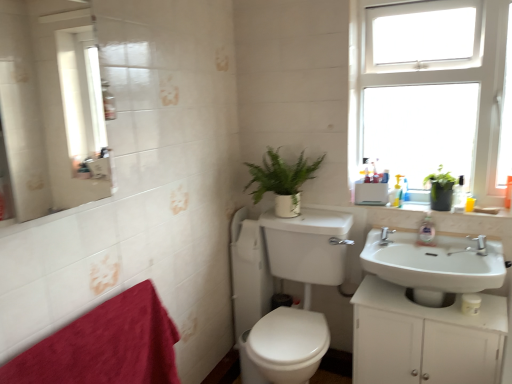
Question: Is white matte cabinet at lower right wider than green matte plant at upper right?

Choices:
 (A) yes
 (B) no

Answer: (A)

Question: Is white matte cabinet at lower right placed right next to green matte plant at upper right?

Choices:
 (A) yes
 (B) no

Answer: (B)

Question: Is white matte cabinet at lower right positioned far away from green matte plant at upper right?

Choices:
 (A) yes
 (B) no

Answer: (B)

Question: Is white matte cabinet at lower right positioned behind green matte plant at upper right?

Choices:
 (A) no
 (B) yes

Answer: (A)

Question: From the image's perspective, is white matte cabinet at lower right over green matte plant at upper right?

Choices:
 (A) no
 (B) yes

Answer: (A)

Question: From a real-world perspective, is white matte cabinet at lower right physically located above or below velvety red bath towel at lower left?

Choices:
 (A) above
 (B) below

Answer: (B)

Question: In terms of width, does white matte cabinet at lower right look wider or thinner when compared to velvety red bath towel at lower left?

Choices:
 (A) thin
 (B) wide

Answer: (B)

Question: Looking at the image, does white matte cabinet at lower right seem bigger or smaller compared to velvety red bath towel at lower left?

Choices:
 (A) small
 (B) big

Answer: (B)

Question: In the image, is white matte cabinet at lower right on the left side or the right side of velvety red bath towel at lower left?

Choices:
 (A) left
 (B) right

Answer: (B)

Question: Does point (442, 173) appear closer or farther from the camera than point (292, 218)?

Choices:
 (A) farther
 (B) closer

Answer: (B)

Question: Which is correct: green matte plant at upper right is inside white glossy sink at center, arranged as the 1th sink when viewed from the left, or outside of it?

Choices:
 (A) outside
 (B) inside

Answer: (A)

Question: Considering the positions of green matte plant at upper right and white glossy sink at center, which appears as the second sink when viewed from the right, in the image, is green matte plant at upper right wider or thinner than white glossy sink at center, which appears as the second sink when viewed from the right,?

Choices:
 (A) wide
 (B) thin

Answer: (B)

Question: Is green matte plant at upper right in front of or behind white glossy sink at center, arranged as the 1th sink when viewed from the left, in the image?

Choices:
 (A) front
 (B) behind

Answer: (B)

Question: From their relative heights in the image, would you say velvety red bath towel at lower left is taller or shorter than white matte toilet paper at lower center?

Choices:
 (A) tall
 (B) short

Answer: (A)

Question: Considering their positions, is velvety red bath towel at lower left located in front of or behind white matte toilet paper at lower center?

Choices:
 (A) front
 (B) behind

Answer: (A)